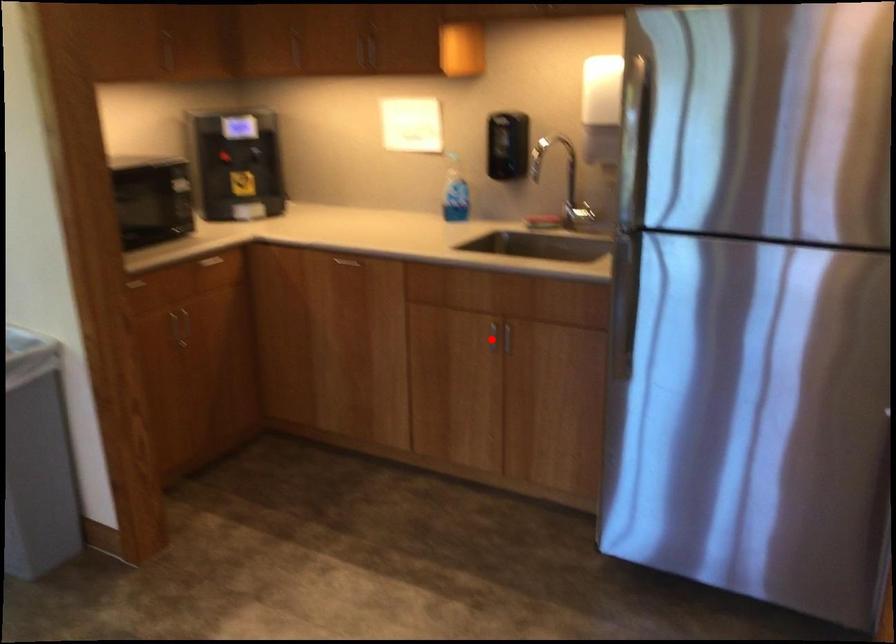
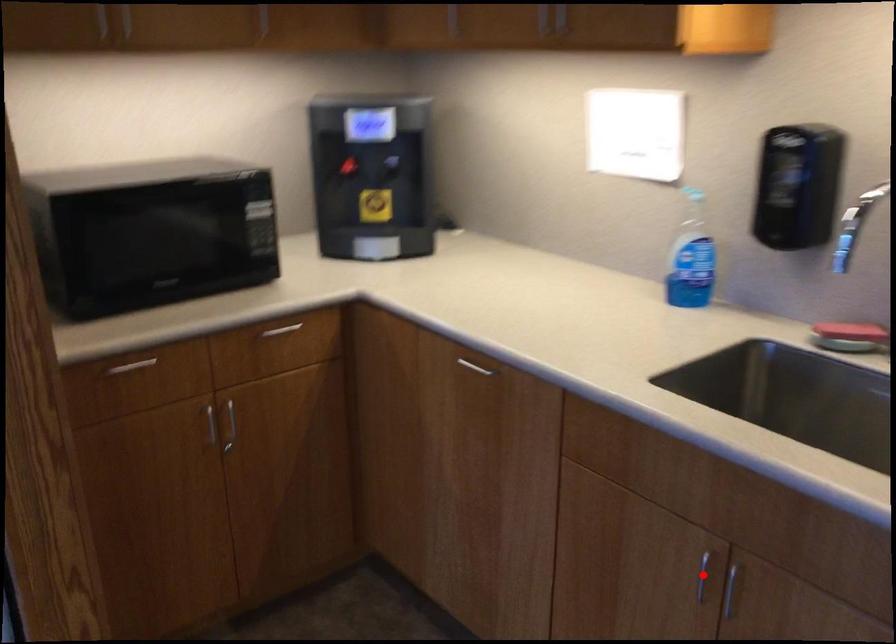
Consider the image. I am providing you with two images of the same scene from different viewpoints. A red point is marked on the first image and another point is marked on the second image. Is the red point in image1 aligned with the point shown in image2?

Yes